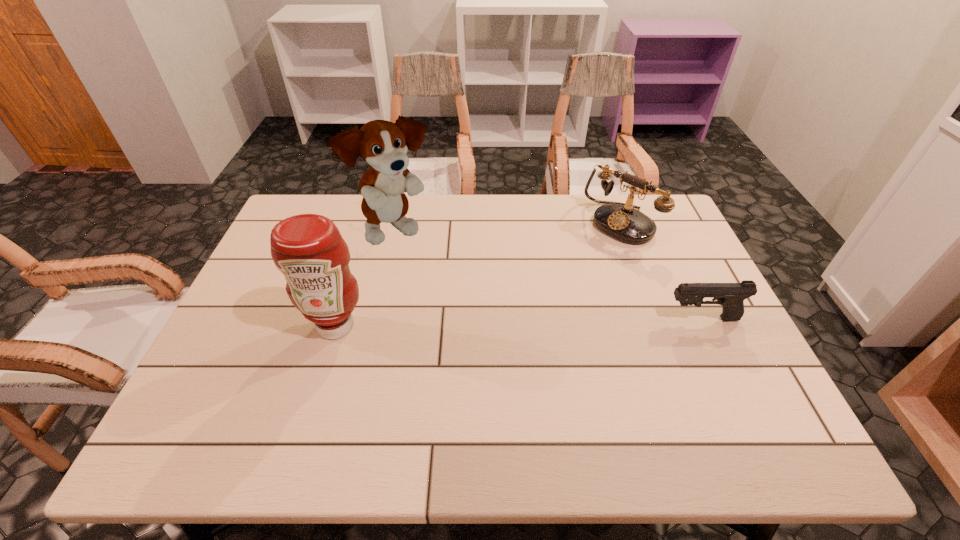
Find the location of a particular element. The height and width of the screenshot is (540, 960). vacant space at the near edge of the desktop is located at coordinates (391, 403).

I want to click on vacant region at the left edge of the desktop, so click(289, 319).

Locate an element on the screen. This screenshot has height=540, width=960. vacant space at the right edge is located at coordinates (660, 262).

Image resolution: width=960 pixels, height=540 pixels. Identify the location of vacant space at the far left corner. (334, 218).

At what (x,y) coordinates should I click in order to perform the action: click on blank region between the third tallest object and the tallest object. Please return your answer as a coordinate pair (x, y). Looking at the image, I should click on (509, 227).

Where is `empty location between the condiment and the shortest object`? This screenshot has height=540, width=960. empty location between the condiment and the shortest object is located at coordinates (518, 322).

In order to click on free space between the third shortest object and the telephone in this screenshot , I will do `click(478, 275)`.

Identify the location of vacant area that lies between the pistol and the third shortest object. point(518,322).

Locate an element on the screen. Image resolution: width=960 pixels, height=540 pixels. unoccupied position between the pistol and the tallest object is located at coordinates (549, 275).

Find the location of a particular element. vacant area that lies between the tallest object and the telephone is located at coordinates (509, 227).